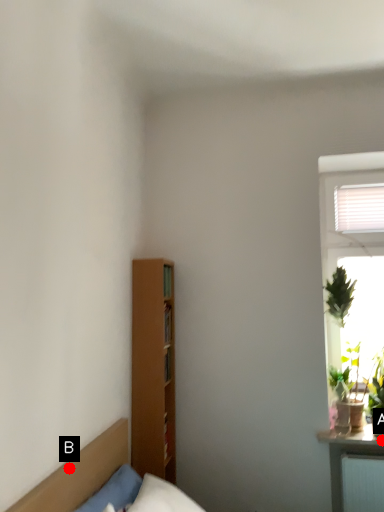
Question: Two points are circled on the image, labeled by A and B beside each circle. Which point is further to the camera?

Choices:
 (A) A is further
 (B) B is further

Answer: (A)